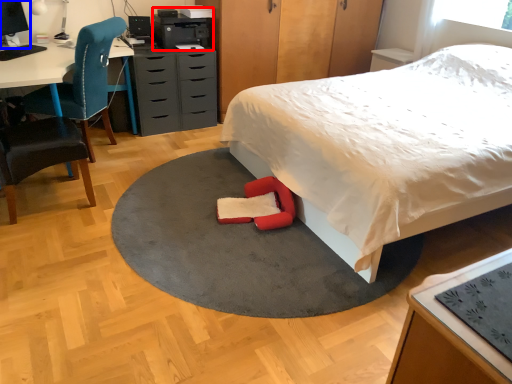
Question: Which object appears farthest to the camera in this image, printer (highlighted by a red box) or computer monitor (highlighted by a blue box)?

Choices:
 (A) printer
 (B) computer monitor

Answer: (A)